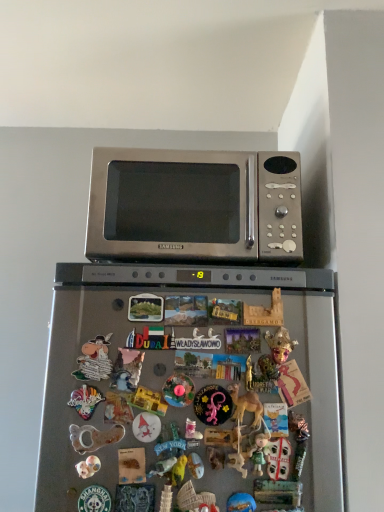
Where is `matte green figurine at lower center, placed as the third toy when sorted from right to left`? Image resolution: width=384 pixels, height=512 pixels. matte green figurine at lower center, placed as the third toy when sorted from right to left is located at coordinates (257, 450).

Measure the distance between matte plastic toy at center, marked as the 9th toy in a right-to-left arrangement, and camera.

32.82 inches.

The width and height of the screenshot is (384, 512). Describe the element at coordinates (195, 387) in the screenshot. I see `satin silver refrigerator at center` at that location.

Locate an element on the screen. The height and width of the screenshot is (512, 384). satin silver refrigerator at center is located at coordinates (195, 387).

Where is `porcelain figurine at lower left, placed as the tenth toy when sorted from right to left`? The width and height of the screenshot is (384, 512). porcelain figurine at lower left, placed as the tenth toy when sorted from right to left is located at coordinates 88,467.

This screenshot has height=512, width=384. Identify the location of matte plastic toy at center, the tenth toy positioned from the left. (278, 458).

What do you see at coordinates (94, 437) in the screenshot? The image size is (384, 512). I see `clear plastic toy at lower left, the eighth toy in the right-to-left sequence` at bounding box center [94, 437].

This screenshot has width=384, height=512. I want to click on matte green figurine at lower center, placed as the third toy when sorted from right to left, so click(x=257, y=450).

Which object is positioned more to the right, matte green figurine at lower center, placed as the third toy when sorted from right to left, or pink rubber toy at center, the fifth toy viewed from the right?

matte green figurine at lower center, placed as the third toy when sorted from right to left.

Who is shorter, matte green figurine at lower center, placed as the third toy when sorted from right to left, or pink rubber toy at center, marked as the 7th toy in a left-to-right arrangement?

pink rubber toy at center, marked as the 7th toy in a left-to-right arrangement.

In the image, is matte green figurine at lower center, which is the ninth toy from left to right, positioned in front of or behind pink rubber toy at center, the fifth toy viewed from the right?

matte green figurine at lower center, which is the ninth toy from left to right, is in front of pink rubber toy at center, the fifth toy viewed from the right.

From the image's perspective, which is above, matte green figurine at lower center, which is the ninth toy from left to right, or pink rubber toy at center, marked as the 7th toy in a left-to-right arrangement?

pink rubber toy at center, marked as the 7th toy in a left-to-right arrangement, appears higher in the image.

The image size is (384, 512). Identify the location of the 6th toy positioned below the metallic gold toy at center, which appears as the sixth toy when viewed from the left (from the image's perspective). (240, 503).

Can you tell me how much blue rubber toy at center, arranged as the fourth toy when viewed from the right, and metallic gold toy at center, the 6th toy from the right, differ in facing direction?

0.00555 degrees separate the facing orientations of blue rubber toy at center, arranged as the fourth toy when viewed from the right, and metallic gold toy at center, the 6th toy from the right.

Considering the relative sizes of blue rubber toy at center, arranged as the fourth toy when viewed from the right, and metallic gold toy at center, the 6th toy from the right, in the image provided, is blue rubber toy at center, arranged as the fourth toy when viewed from the right, wider than metallic gold toy at center, the 6th toy from the right,?

No.

Between blue rubber toy at center, arranged as the fourth toy when viewed from the right, and metallic gold toy at center, the 6th toy from the right, which one has less height?

metallic gold toy at center, the 6th toy from the right.

Can you confirm if matte green figurine at lower center, placed as the third toy when sorted from right to left, is smaller than matte plastic toy at center, the tenth toy positioned from the left?

Yes, matte green figurine at lower center, placed as the third toy when sorted from right to left, is smaller than matte plastic toy at center, the tenth toy positioned from the left.

Is matte green figurine at lower center, which is the ninth toy from left to right, at the right side of matte plastic toy at center, the tenth toy positioned from the left?

In fact, matte green figurine at lower center, which is the ninth toy from left to right, is to the left of matte plastic toy at center, the tenth toy positioned from the left.

Locate an element on the screen. The width and height of the screenshot is (384, 512). toy that is the 1st object located behind the matte green figurine at lower center, which is the ninth toy from left to right is located at coordinates (278, 458).

From the image's perspective, is matte green figurine at lower center, placed as the third toy when sorted from right to left, on matte plastic toy at center, which ranks as the 2th toy in right-to-left order?

Yes, from the image's perspective, matte green figurine at lower center, placed as the third toy when sorted from right to left, is over matte plastic toy at center, which ranks as the 2th toy in right-to-left order.

From the image's perspective, between satin silver microwave at upper center and gold metallic crown at upper center, arranged as the eleventh toy when viewed from the left, who is located below?

gold metallic crown at upper center, arranged as the eleventh toy when viewed from the left, from the image's perspective.

Is satin silver microwave at upper center with gold metallic crown at upper center, arranged as the eleventh toy when viewed from the left?

No, satin silver microwave at upper center is not with gold metallic crown at upper center, arranged as the eleventh toy when viewed from the left.

Considering the sizes of objects satin silver microwave at upper center and gold metallic crown at upper center, which is counted as the first toy, starting from the right, in the image provided, who is wider, satin silver microwave at upper center or gold metallic crown at upper center, which is counted as the first toy, starting from the right,?

satin silver microwave at upper center is wider.

Considering the relative positions of satin silver microwave at upper center and gold metallic crown at upper center, arranged as the eleventh toy when viewed from the left, in the image provided, is satin silver microwave at upper center to the right of gold metallic crown at upper center, arranged as the eleventh toy when viewed from the left, from the viewer's perspective?

No, satin silver microwave at upper center is not to the right of gold metallic crown at upper center, arranged as the eleventh toy when viewed from the left.

From a real-world perspective, is satin silver refrigerator at center over metallic gold toy at center, which appears as the sixth toy when viewed from the left?

No.

Who is taller, satin silver refrigerator at center or metallic gold toy at center, which appears as the sixth toy when viewed from the left?

satin silver refrigerator at center is taller.

Is satin silver refrigerator at center not close to metallic gold toy at center, which appears as the sixth toy when viewed from the left?

satin silver refrigerator at center is near metallic gold toy at center, which appears as the sixth toy when viewed from the left, not far away.

Is pink rubber toy at center, the fifth toy viewed from the right, oriented towards porcelain figurine at lower left, which appears as the second toy when viewed from the left?

No, pink rubber toy at center, the fifth toy viewed from the right, does not turn towards porcelain figurine at lower left, which appears as the second toy when viewed from the left.

At what (x,y) coordinates should I click in order to perform the action: click on toy that is the 3rd object located in front of the pink rubber toy at center, marked as the 7th toy in a left-to-right arrangement. Please return your answer as a coordinate pair (x, y). This screenshot has height=512, width=384. Looking at the image, I should click on (88, 467).

Considering the sizes of objects pink rubber toy at center, the fifth toy viewed from the right, and porcelain figurine at lower left, placed as the tenth toy when sorted from right to left, in the image provided, who is bigger, pink rubber toy at center, the fifth toy viewed from the right, or porcelain figurine at lower left, placed as the tenth toy when sorted from right to left,?

pink rubber toy at center, the fifth toy viewed from the right.

Based on the photo, between blue rubber toy at center, which is counted as the 8th toy, starting from the left, and matte plastic toy at center, the tenth toy positioned from the left, which one has larger width?

Wider between the two is matte plastic toy at center, the tenth toy positioned from the left.

Consider the image. Considering the relative sizes of blue rubber toy at center, which is counted as the 8th toy, starting from the left, and matte plastic toy at center, which ranks as the 2th toy in right-to-left order, in the image provided, is blue rubber toy at center, which is counted as the 8th toy, starting from the left, bigger than matte plastic toy at center, which ranks as the 2th toy in right-to-left order,?

Incorrect, blue rubber toy at center, which is counted as the 8th toy, starting from the left, is not larger than matte plastic toy at center, which ranks as the 2th toy in right-to-left order.

Is blue rubber toy at center, arranged as the fourth toy when viewed from the right, to the right of matte plastic toy at center, the tenth toy positioned from the left, from the viewer's perspective?

No, blue rubber toy at center, arranged as the fourth toy when viewed from the right, is not to the right of matte plastic toy at center, the tenth toy positioned from the left.

From a real-world perspective, starting from the pink rubber toy at center, marked as the 7th toy in a left-to-right arrangement, which toy is the 4th one below it? Please provide its 2D coordinates.

[(257, 450)]

This screenshot has height=512, width=384. I want to click on the 5th toy behind the blue rubber toy at center, which is counted as the 8th toy, starting from the left, counting from the anchor's position, so point(149,401).

When comparing their distances from pink rubber toy at center, marked as the 7th toy in a left-to-right arrangement, does metallic gold toy at center, which appears as the sixth toy when viewed from the left, or matte plastic toy at center, the tenth toy positioned from the left, seem further?

matte plastic toy at center, the tenth toy positioned from the left, is positioned further to the anchor pink rubber toy at center, marked as the 7th toy in a left-to-right arrangement.

Looking at the image, which one is located further to matte plastic toy at center, which ranks as the 2th toy in right-to-left order, satin silver refrigerator at center or pink rubber toy at center, the fifth toy viewed from the right?

The object further to matte plastic toy at center, which ranks as the 2th toy in right-to-left order, is satin silver refrigerator at center.

Looking at the image, which one is located closer to clear plastic toy at lower left, the eighth toy in the right-to-left sequence, metallic silver toy at lower left, the eleventh toy from the right, or satin silver microwave at upper center?

metallic silver toy at lower left, the eleventh toy from the right.

From the image, which object appears to be farther from porcelain figurine at lower left, which appears as the second toy when viewed from the left, matte green figurine at lower center, placed as the third toy when sorted from right to left, or matte plastic toy at center, which ranks as the 2th toy in right-to-left order?

matte plastic toy at center, which ranks as the 2th toy in right-to-left order.

When comparing their distances from porcelain figurine at lower left, placed as the tenth toy when sorted from right to left, does matte plastic toy at center, the tenth toy positioned from the left, or clear plastic toy at lower left, the eighth toy in the right-to-left sequence, seem further?

matte plastic toy at center, the tenth toy positioned from the left, is further to porcelain figurine at lower left, placed as the tenth toy when sorted from right to left.

Based on their spatial positions, is satin silver microwave at upper center or metallic gold toy at center, the 6th toy from the right, further from matte green figurine at lower center, placed as the third toy when sorted from right to left?

satin silver microwave at upper center is positioned further to the anchor matte green figurine at lower center, placed as the third toy when sorted from right to left.

In the scene shown: When comparing their distances from matte plastic toy at center, the tenth toy positioned from the left, does matte green figurine at lower center, which is the ninth toy from left to right, or metallic silver unicorn at center, arranged as the seventh toy when viewed from the right, seem closer?

Among the two, matte green figurine at lower center, which is the ninth toy from left to right, is located nearer to matte plastic toy at center, the tenth toy positioned from the left.

Considering their positions, is matte green figurine at lower center, which is the ninth toy from left to right, positioned further to satin silver refrigerator at center than gold metallic crown at upper center, arranged as the eleventh toy when viewed from the left?

Among the two, gold metallic crown at upper center, arranged as the eleventh toy when viewed from the left, is located further to satin silver refrigerator at center.

The image size is (384, 512). I want to click on refrigerator between matte plastic toy at center, arranged as the 3th toy when viewed from the left, and matte green figurine at lower center, which is the ninth toy from left to right, in the horizontal direction, so click(x=195, y=387).

Find the location of `refrigerator between metallic silver unicorn at center, which is the fifth toy in left-to-right order, and gold metallic crown at upper center, which is counted as the first toy, starting from the right`. refrigerator between metallic silver unicorn at center, which is the fifth toy in left-to-right order, and gold metallic crown at upper center, which is counted as the first toy, starting from the right is located at coordinates (195, 387).

Where is `refrigerator between porcelain figurine at lower left, which appears as the second toy when viewed from the left, and blue rubber toy at center, arranged as the fourth toy when viewed from the right`? This screenshot has height=512, width=384. refrigerator between porcelain figurine at lower left, which appears as the second toy when viewed from the left, and blue rubber toy at center, arranged as the fourth toy when viewed from the right is located at coordinates (195, 387).

Where is `refrigerator between metallic silver toy at lower left, the eleventh toy from the right, and matte green figurine at lower center, which is the ninth toy from left to right`? Image resolution: width=384 pixels, height=512 pixels. refrigerator between metallic silver toy at lower left, the eleventh toy from the right, and matte green figurine at lower center, which is the ninth toy from left to right is located at coordinates (195, 387).